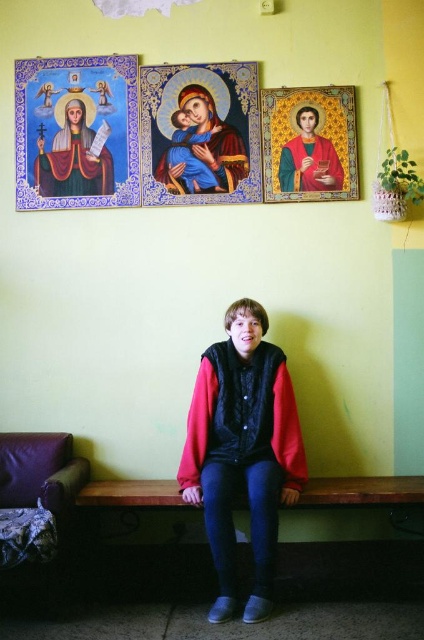
Question: Among these objects, which one is farthest from the camera?

Choices:
 (A) red fleece jacket at center
 (B) matte gold icon at upper left

Answer: (B)

Question: Is red fleece jacket at center below matte blue fabric at center?

Choices:
 (A) yes
 (B) no

Answer: (A)

Question: Which object appears farthest from the camera in this image?

Choices:
 (A) gold textured icon at upper center
 (B) matte blue fabric at center
 (C) matte gold icon at upper left

Answer: (C)

Question: In this image, where is matte gold icon at upper left located relative to gold textured icon at upper center?

Choices:
 (A) above
 (B) below

Answer: (A)

Question: Does red fleece jacket at center lie behind matte gold icon at upper left?

Choices:
 (A) no
 (B) yes

Answer: (A)

Question: Based on their relative distances, which object is farther from the red fleece jacket at center?

Choices:
 (A) matte gold icon at upper left
 (B) matte blue fabric at center

Answer: (A)